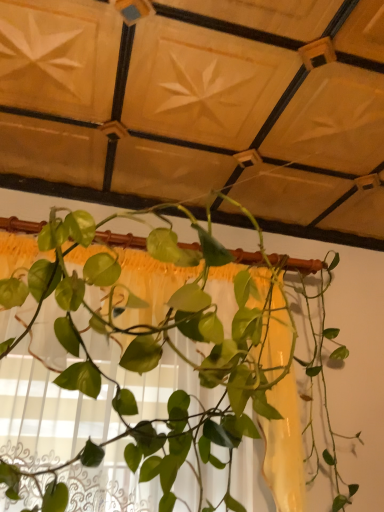
What is the approximate height of green glossy leaves at center?

green glossy leaves at center is 33.02 inches tall.

Describe the element at coordinates (162, 348) in the screenshot. The image size is (384, 512). I see `green glossy leaves at center` at that location.

Identify the location of green glossy leaves at center. (162, 348).

The image size is (384, 512). Identify the location of green glossy leaves at center. (162, 348).